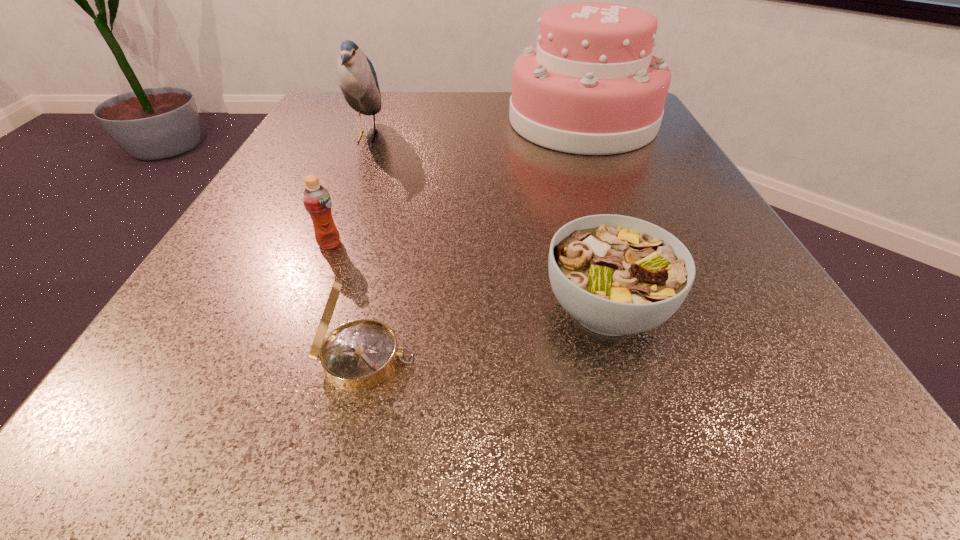
This screenshot has height=540, width=960. In order to click on free space at the near edge of the desktop in this screenshot , I will do `click(400, 389)`.

Image resolution: width=960 pixels, height=540 pixels. In the image, there is a desktop. In order to click on free region at the left edge in this screenshot , I will do click(260, 345).

In the image, there is a desktop. Where is `vacant space at the right edge`? Image resolution: width=960 pixels, height=540 pixels. vacant space at the right edge is located at coordinates (660, 177).

Find the location of `vacant space at the far left corner of the desktop`. vacant space at the far left corner of the desktop is located at coordinates (323, 97).

The height and width of the screenshot is (540, 960). What are the coordinates of `blank space at the near left corner` in the screenshot? It's located at (177, 407).

I want to click on vacant space at the near right corner of the desktop, so click(x=740, y=421).

Locate an element on the screen. This screenshot has width=960, height=540. empty space between the birthday cake and the bird is located at coordinates (474, 129).

The image size is (960, 540). I want to click on free space that is in between the compass and the birthday cake, so click(474, 240).

The width and height of the screenshot is (960, 540). What are the coordinates of `free space between the third object from right to left and the orange juice` in the screenshot? It's located at (348, 301).

Identify the location of unoccupied area between the compass and the shortest object. (486, 334).